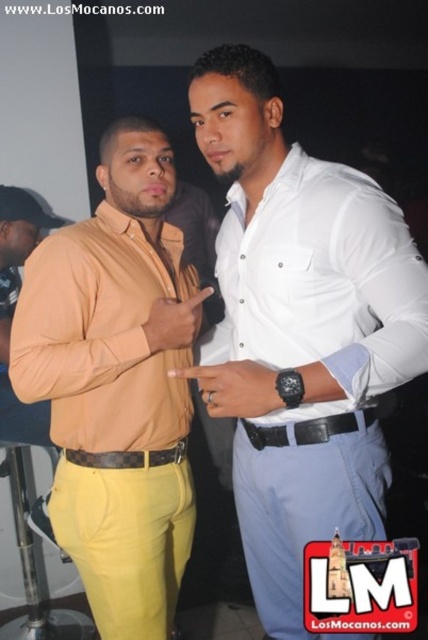
Question: Can you confirm if white cotton shirt at right is wider than brown leather belt at center?

Choices:
 (A) yes
 (B) no

Answer: (A)

Question: Among these points, which one is farthest from the camera?

Choices:
 (A) (240, 216)
 (B) (44, 240)

Answer: (A)

Question: Which is farther from the matte yellow pants at left?

Choices:
 (A) brown leather belt at center
 (B) white cotton shirt at right
 (C) white smooth shirt at center

Answer: (B)

Question: Can you confirm if white smooth shirt at center is positioned to the right of white cotton shirt at right?

Choices:
 (A) yes
 (B) no

Answer: (B)

Question: In this image, where is matte yellow pants at left located relative to brown leather belt at center?

Choices:
 (A) left
 (B) right

Answer: (A)

Question: Which point is farther to the camera?

Choices:
 (A) black leather belt at center
 (B) brown leather belt at center

Answer: (B)